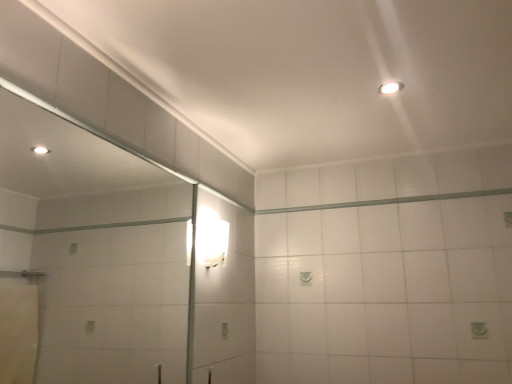
Question: From a real-world perspective, relative to clear glass mirror at left, is white glossy wall sconce at upper center, the 1th light fixture ordered from the bottom, vertically above or below?

Choices:
 (A) below
 (B) above

Answer: (B)

Question: Looking at their shapes, would you say white glossy wall sconce at upper center, which is counted as the second light fixture, starting from the top, is wider or thinner than clear glass mirror at left?

Choices:
 (A) thin
 (B) wide

Answer: (B)

Question: Which is nearer to the white glossy wall sconce at upper center, which is counted as the second light fixture, starting from the top?

Choices:
 (A) white glossy light fixture at upper right, marked as the 1th light fixture in a front-to-back arrangement
 (B) white glossy beam at upper center
 (C) clear glass mirror at left

Answer: (B)

Question: Which object is positioned farthest from the clear glass mirror at left?

Choices:
 (A) white glossy beam at upper center
 (B) white glossy wall sconce at upper center, the first light fixture from the back
 (C) white glossy light fixture at upper right, the 1th light fixture in the top-to-bottom sequence

Answer: (C)